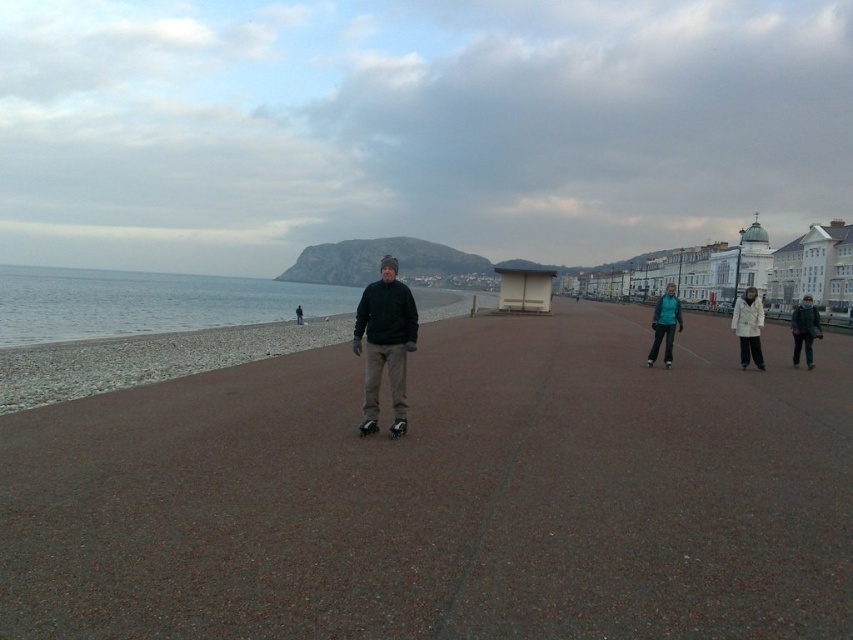
Question: Which of the following is the farthest from the observer?

Choices:
 (A) (802, 316)
 (B) (389, 372)
 (C) (300, 323)

Answer: (C)

Question: Can you confirm if matte black jacket at center is positioned to the right of dark gray hoodie at center?

Choices:
 (A) no
 (B) yes

Answer: (B)

Question: Which of the following is the farthest from the observer?

Choices:
 (A) (674, 291)
 (B) (796, 365)

Answer: (B)

Question: Is brown textured pavement at center thinner than teal fabric jacket at center-right?

Choices:
 (A) yes
 (B) no

Answer: (A)

Question: Which point is closer to the camera?

Choices:
 (A) pos(808,332)
 (B) pos(749,349)
 (C) pos(318,410)

Answer: (C)

Question: Does white matte jacket at right come behind teal fabric jacket at center-right?

Choices:
 (A) no
 (B) yes

Answer: (A)